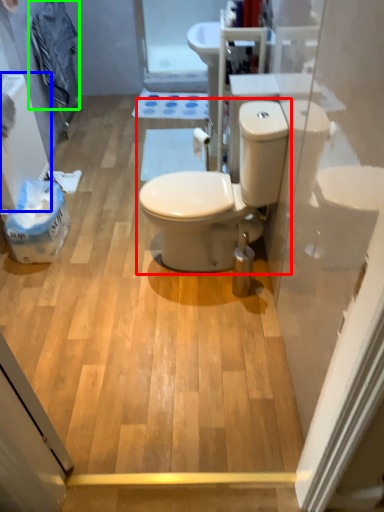
Question: Which is nearer to the toilet (highlighted by a red box)? radiator (highlighted by a blue box) or laundry (highlighted by a green box).

Choices:
 (A) radiator
 (B) laundry

Answer: (A)